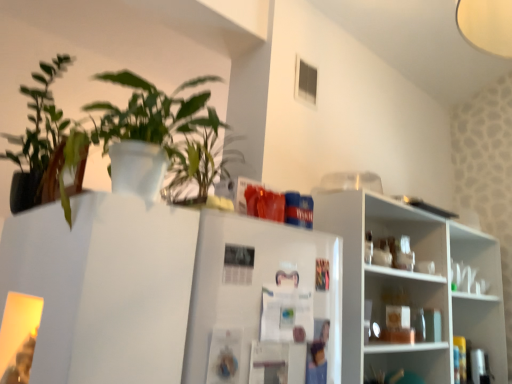
Question: From a real-world perspective, is green matte plant at upper left, the 1th houseplant when ordered from right to left, under green matte plant at upper left, marked as the 1th houseplant in a left-to-right arrangement?

Choices:
 (A) yes
 (B) no

Answer: (A)

Question: Does green matte plant at upper left, marked as the 2th houseplant in a left-to-right arrangement, appear on the left side of green matte plant at upper left, marked as the 2th houseplant in a right-to-left arrangement?

Choices:
 (A) no
 (B) yes

Answer: (A)

Question: Can you confirm if green matte plant at upper left, marked as the 2th houseplant in a left-to-right arrangement, is thinner than green matte plant at upper left, marked as the 2th houseplant in a right-to-left arrangement?

Choices:
 (A) yes
 (B) no

Answer: (A)

Question: From the image's perspective, would you say green matte plant at upper left, marked as the 2th houseplant in a left-to-right arrangement, is positioned over green matte plant at upper left, marked as the 1th houseplant in a left-to-right arrangement?

Choices:
 (A) yes
 (B) no

Answer: (B)

Question: Is green matte plant at upper left, the 1th houseplant when ordered from right to left, directly adjacent to green matte plant at upper left, marked as the 1th houseplant in a left-to-right arrangement?

Choices:
 (A) no
 (B) yes

Answer: (A)

Question: From a real-world perspective, is green matte plant at upper left, the 1th houseplant when ordered from right to left, above or below white paperboard fridge at center?

Choices:
 (A) below
 (B) above

Answer: (B)

Question: Looking at the image, does green matte plant at upper left, the 1th houseplant when ordered from right to left, seem bigger or smaller compared to white paperboard fridge at center?

Choices:
 (A) big
 (B) small

Answer: (A)

Question: Considering the relative positions of green matte plant at upper left, the 1th houseplant when ordered from right to left, and white paperboard fridge at center in the image provided, is green matte plant at upper left, the 1th houseplant when ordered from right to left, to the left or to the right of white paperboard fridge at center?

Choices:
 (A) right
 (B) left

Answer: (B)

Question: In the image, is green matte plant at upper left, marked as the 2th houseplant in a left-to-right arrangement, positioned in front of or behind white paperboard fridge at center?

Choices:
 (A) behind
 (B) front

Answer: (B)

Question: In the image, is white paperboard fridge at center on the left side or the right side of white glossy shelves at right, the first shelf positioned from the top?

Choices:
 (A) right
 (B) left

Answer: (B)

Question: Considering the positions of white paperboard fridge at center and white glossy shelves at right, the second shelf in the bottom-to-top sequence, in the image, is white paperboard fridge at center wider or thinner than white glossy shelves at right, the second shelf in the bottom-to-top sequence,?

Choices:
 (A) thin
 (B) wide

Answer: (A)

Question: Considering their positions, is white paperboard fridge at center located in front of or behind white glossy shelves at right, the second shelf in the bottom-to-top sequence?

Choices:
 (A) front
 (B) behind

Answer: (A)

Question: Does point (226, 231) appear closer or farther from the camera than point (395, 357)?

Choices:
 (A) farther
 (B) closer

Answer: (B)

Question: In terms of size, does white glossy shelves at right, the second shelf in the bottom-to-top sequence, appear bigger or smaller than white glossy shelf at lower right, the 2th shelf viewed from the top?

Choices:
 (A) small
 (B) big

Answer: (B)

Question: From a real-world perspective, is white glossy shelves at right, the second shelf in the bottom-to-top sequence, physically located above or below white glossy shelf at lower right, the 2th shelf viewed from the top?

Choices:
 (A) below
 (B) above

Answer: (B)